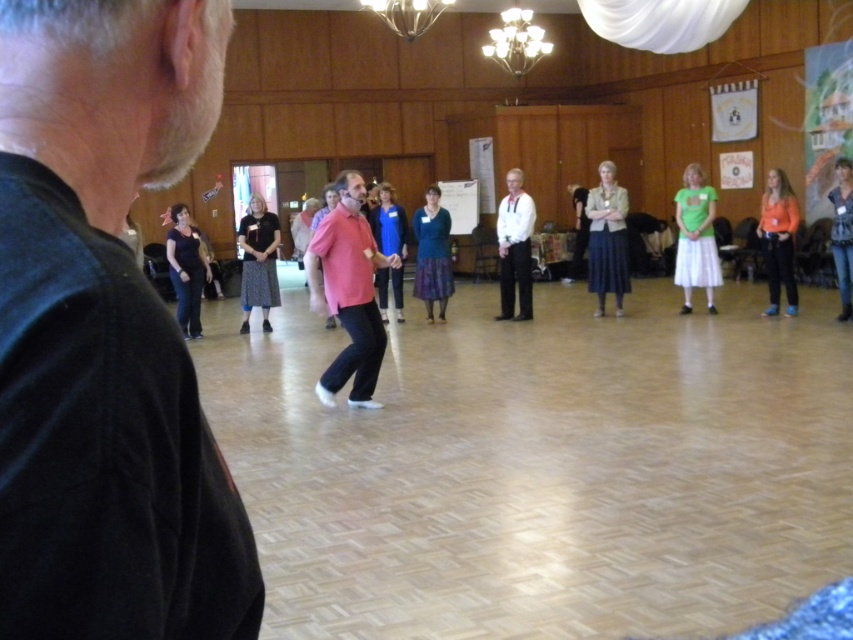
Describe the element at coordinates (387, 224) in the screenshot. The height and width of the screenshot is (640, 853). I see `blue fabric skirt at center` at that location.

Does point (399, 259) come farther from viewer compared to point (537, 32)?

No, it is not.

At what (x,y) coordinates should I click in order to perform the action: click on blue fabric skirt at center. Please return your answer as a coordinate pair (x, y). Looking at the image, I should click on (387, 224).

Can you confirm if white smooth shirt at center is positioned to the right of blue fabric skirt at center?

Yes, white smooth shirt at center is to the right of blue fabric skirt at center.

Does white smooth shirt at center appear on the left side of blue fabric skirt at center?

In fact, white smooth shirt at center is to the right of blue fabric skirt at center.

The image size is (853, 640). What are the coordinates of `white smooth shirt at center` in the screenshot? It's located at (515, 248).

Is matte black shirt at left further to camera compared to matte black shirt at center?

No.

Does matte black shirt at left appear on the left side of matte black shirt at center?

In fact, matte black shirt at left is to the right of matte black shirt at center.

Does point (45, 179) come in front of point (178, 248)?

That is True.

Image resolution: width=853 pixels, height=640 pixels. What are the coordinates of `matte black shirt at left` in the screenshot? It's located at (106, 333).